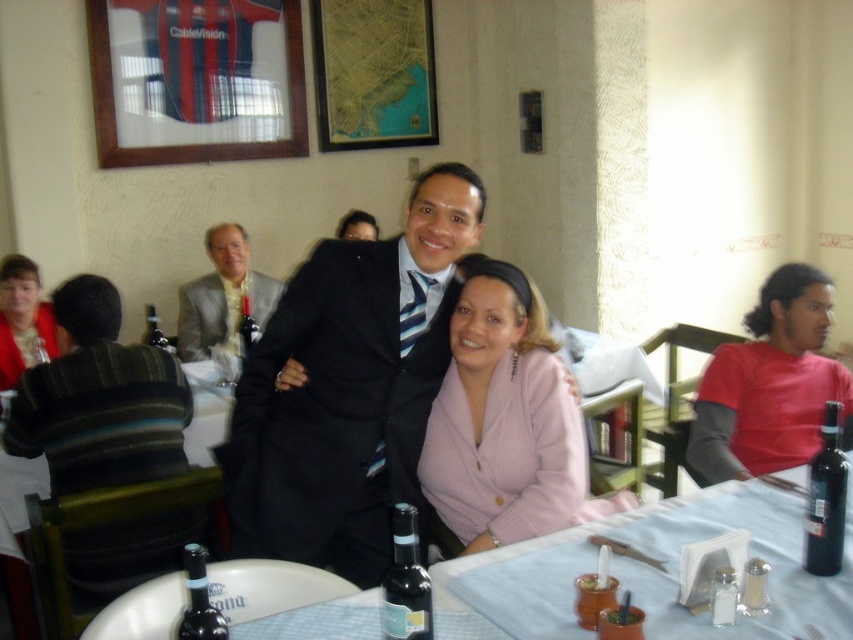
Which is behind, point (543, 337) or point (245, 314)?

The point (245, 314) is behind.

Who is higher up, pink fleece jacket at center or dark glass bottle at center?

dark glass bottle at center is higher up.

Which is behind, point (485, 388) or point (236, 326)?

The point (236, 326) is more distant.

The image size is (853, 640). Identify the location of pink fleece jacket at center. (502, 419).

Who is taller, matte red sweater at left or dark glass bottle at center?

With more height is matte red sweater at left.

Which is behind, point (9, 326) or point (244, 316)?

Positioned behind is point (244, 316).

Is point (49, 317) closer to camera compared to point (241, 326)?

That is False.

Locate an element on the screen. The width and height of the screenshot is (853, 640). matte red sweater at left is located at coordinates [x=22, y=317].

Is black glass bottle at lower right bigger than dark green glass bottle at table center?

Actually, black glass bottle at lower right might be smaller than dark green glass bottle at table center.

Is point (817, 520) closer to camera compared to point (416, 538)?

No, it is not.

You are a GUI agent. You are given a task and a screenshot of the screen. Output one action in this format:
    pyautogui.click(x=<x>, y=<y>)
    Task: Click on the black glass bottle at lower right
    
    Given the screenshot: What is the action you would take?
    pyautogui.click(x=825, y=499)